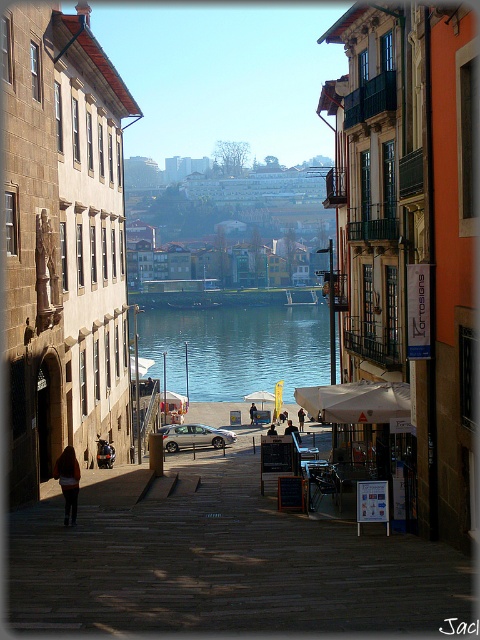
Is point (190, 396) farther from camera compared to point (288, 422)?

Yes, point (190, 396) is farther from viewer.

The image size is (480, 640). Describe the element at coordinates (237, 348) in the screenshot. I see `blue glassy water at center` at that location.

Which is behind, point (266, 360) or point (288, 426)?

The point (266, 360) is more distant.

The image size is (480, 640). In order to click on blue glassy water at center in this screenshot , I will do `click(237, 348)`.

Can you confirm if dark blue jeans at center is taller than dark brown leather jacket at center?

Indeed, dark blue jeans at center has a greater height compared to dark brown leather jacket at center.

Between dark blue jeans at center and dark brown leather jacket at center, which one has more height?

Standing taller between the two is dark blue jeans at center.

Describe the element at coordinates (291, 429) in the screenshot. This screenshot has height=640, width=480. I see `dark blue jeans at center` at that location.

You are a GUI agent. You are given a task and a screenshot of the screen. Output one action in this format:
    pyautogui.click(x=<x>, y=<y>)
    Task: Click on the dark blue jeans at center
    This screenshot has height=640, width=480.
    Given the screenshot: What is the action you would take?
    pyautogui.click(x=291, y=429)

Can you confirm if dark brown leather jacket at lower left is bigger than brown leather jacket at lower left?

Yes.

Is dark brown leather jacket at lower left behind brown leather jacket at lower left?

No, it is not.

Which is behind, point (72, 515) or point (254, 412)?

The point (254, 412) is more distant.

The width and height of the screenshot is (480, 640). I want to click on dark brown leather jacket at lower left, so click(68, 481).